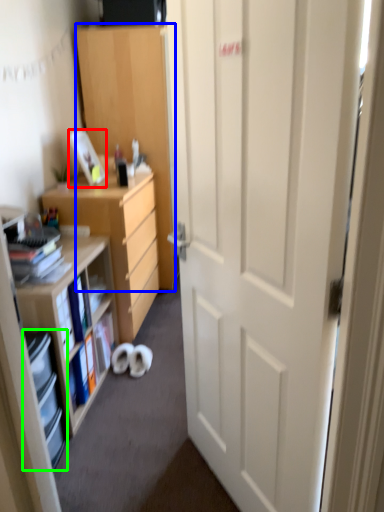
Question: Which object is the closest to the picture frame (highlighted by a red box)? Choose among these: cabinetry (highlighted by a blue box) or shelf (highlighted by a green box).

Choices:
 (A) cabinetry
 (B) shelf

Answer: (A)